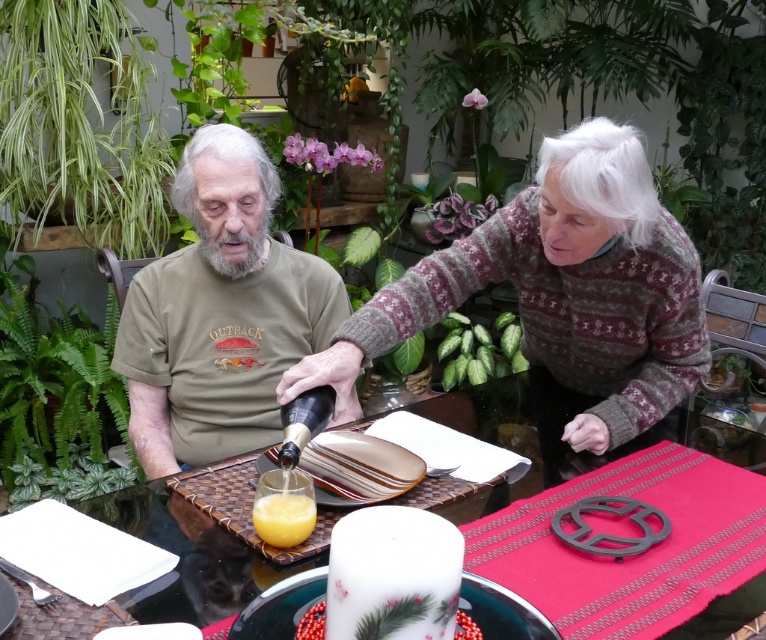
Question: Is translucent glass table at center smaller than translucent glass cup at center?

Choices:
 (A) yes
 (B) no

Answer: (B)

Question: Is knitted sweater at upper right further to camera compared to white glossy candle at center?

Choices:
 (A) yes
 (B) no

Answer: (A)

Question: In this image, where is knitted sweater at upper right located relative to white glossy candle at center?

Choices:
 (A) above
 (B) below

Answer: (A)

Question: Which is farther from the knitted sweater at upper right?

Choices:
 (A) translucent glass cup at center
 (B) green matte shirt at center
 (C) translucent glass table at center

Answer: (A)

Question: Estimate the real-world distances between objects in this image. Which object is closer to the green matte shirt at center?

Choices:
 (A) translucent glass table at center
 (B) knitted sweater at upper right
 (C) white glossy candle at center
 (D) translucent glass cup at center

Answer: (A)

Question: Considering the real-world distances, which object is farthest from the green matte shirt at center?

Choices:
 (A) knitted sweater at upper right
 (B) translucent glass cup at center

Answer: (B)